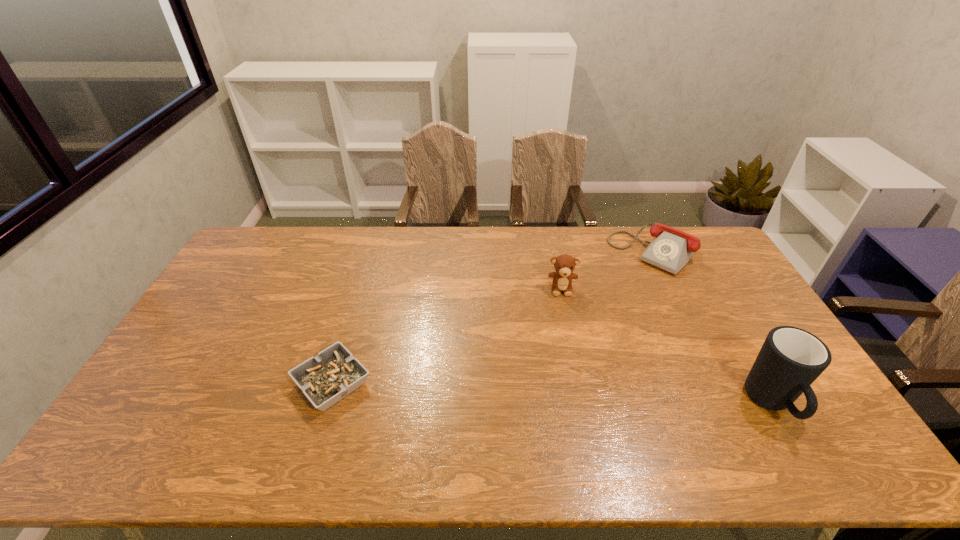
The height and width of the screenshot is (540, 960). I want to click on free space on the desktop that is between the leftmost object and the mug and is positioned on the face of the teddy bear, so click(569, 394).

At what (x,y) coordinates should I click in order to perform the action: click on free space on the desktop that is between the leftmost object and the mug and is positioned on the dial of the second shortest object. Please return your answer as a coordinate pair (x, y). The height and width of the screenshot is (540, 960). Looking at the image, I should click on tap(528, 393).